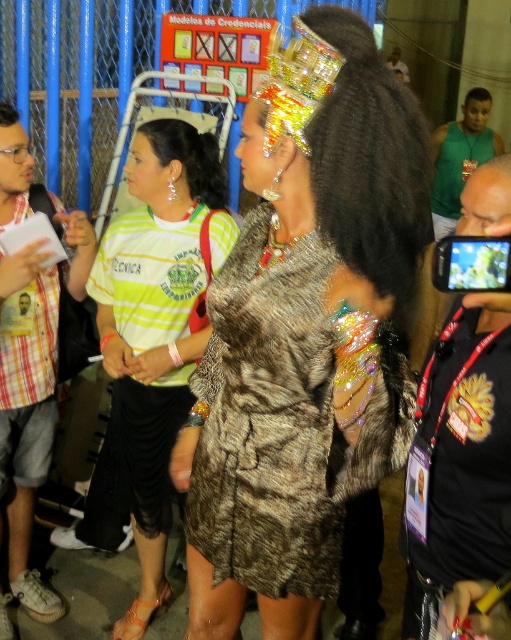
You are standing at the center of the image and see a point marked at coordinates (x=27, y=410). Which object is this point located on?

The point at coordinates (x=27, y=410) is located on the plaid cotton shirt at left.

You are attending a festival and want to take a photo of the green striped shirt at center and the plaid cotton shirt at left. Which one is closer to the camera?

The green striped shirt at center is closer to the camera because it is in front of the plaid cotton shirt at left.